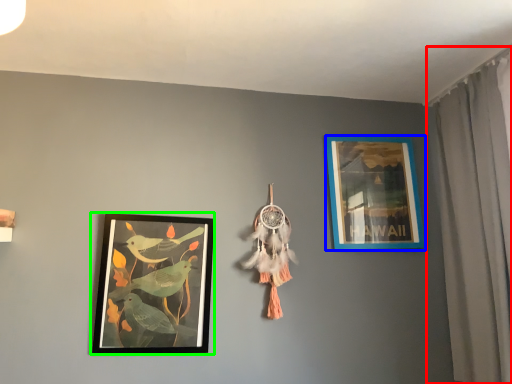
Question: Which is farther away from curtain (highlighted by a red box)? picture frame (highlighted by a blue box) or picture frame (highlighted by a green box)?

Choices:
 (A) picture frame
 (B) picture frame

Answer: (B)